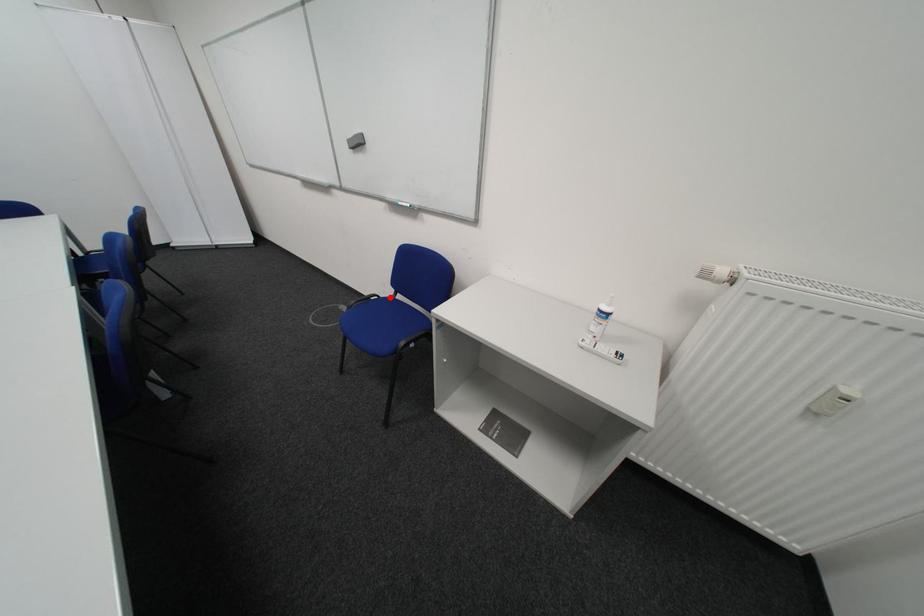
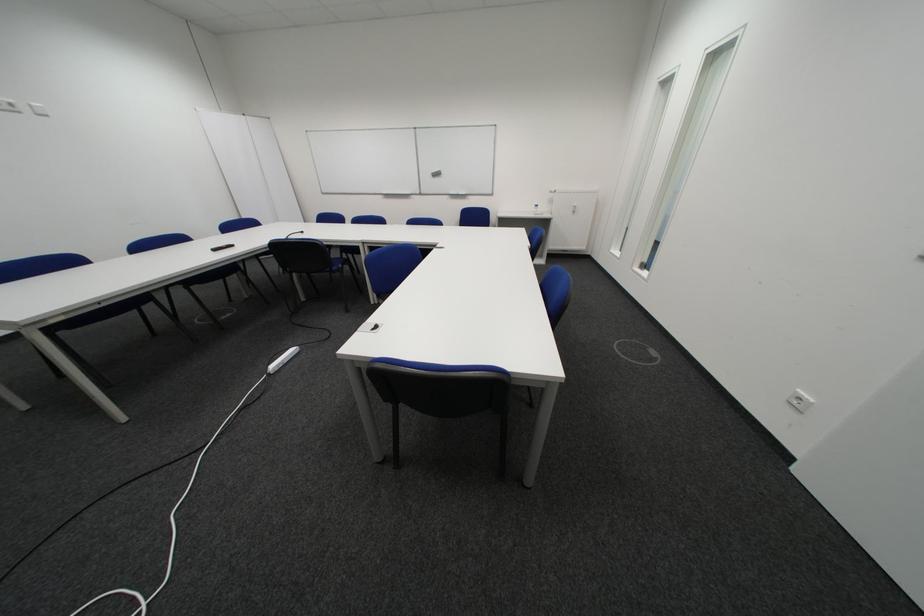
Question: I am providing you with two images of the same scene from different viewpoints. A red point is marked on the first image. Is the red point's position out of view in image 2?

Choices:
 (A) Yes
 (B) No

Answer: (A)